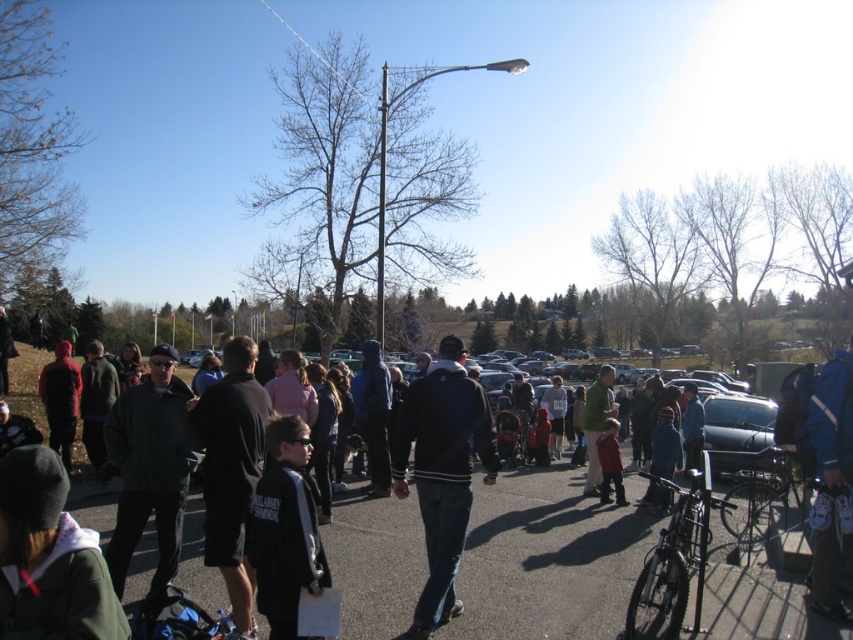
Question: Based on their relative distances, which object is farther from the shiny black bike at lower right?

Choices:
 (A) red matte jacket at center
 (B) dark green jacket at center
 (C) green wool jacket at lower left
 (D) black fleece jacket at center

Answer: (A)

Question: Which point is farther from the camera taking this photo?

Choices:
 (A) (x=746, y=476)
 (B) (x=463, y=424)
 (C) (x=595, y=456)

Answer: (A)

Question: Can you confirm if black fabric jacket at center is thinner than red matte jacket at center?

Choices:
 (A) no
 (B) yes

Answer: (A)

Question: Is black fleece jacket at center bigger than blue fabric jacket at lower right?

Choices:
 (A) no
 (B) yes

Answer: (B)

Question: Is black fleece jacket at center below black fabric jacket at center?

Choices:
 (A) yes
 (B) no

Answer: (A)

Question: Which point is closer to the camera?

Choices:
 (A) (453, 376)
 (B) (816, 536)
 (C) (607, 396)

Answer: (B)